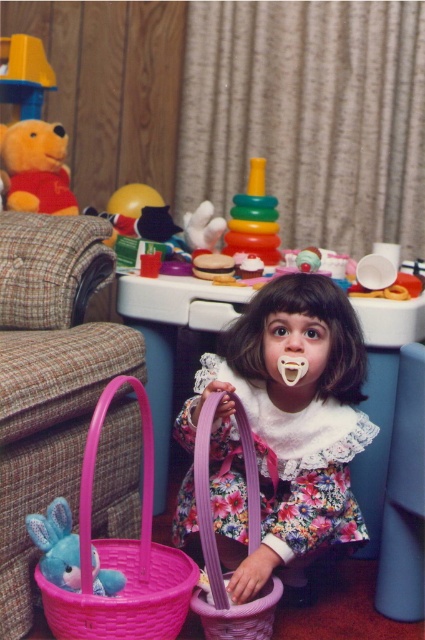
You are a toy organizer in the playroom. The multicolored plastic stacking rings at center are placed at coordinates 0.344, 0.598. If you need to place a new toy at coordinates 0.35, 0.6, will it overlap with the existing rings?

The multicolored plastic stacking rings at center are located at point [254,220]. Placing a new toy at [255,224] would be very close but not exactly overlapping. However, depending on the size of the new toy and the rings, there might be an overlap. Since the coordinates are nearly the same, it is likely that the new toy would overlap with the existing rings.

You are a photographer trying to capture the child in the center of the image. There is a specific point at coordinates point (286, 428) that you need to focus on. According to the scene description, where exactly is this point located on the child?

The point (286, 428) is located on the floral fabric dress at center.

You are a photographer adjusting your camera to focus on two specific points in the image. The first point is at coordinates point (95, 444) and the second is at point (56, 166). Which point should you focus on first if you want to capture the closest one to the camera?

Point (95, 444) is closer to the camera than point (56, 166), so you should focus on point (95, 444) first.